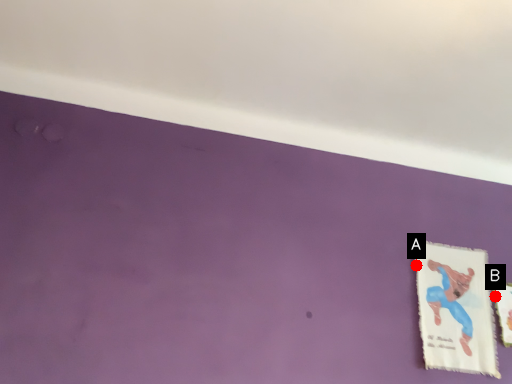
Question: Two points are circled on the image, labeled by A and B beside each circle. Which of the following is the closest to the observer?

Choices:
 (A) A is closer
 (B) B is closer

Answer: (A)